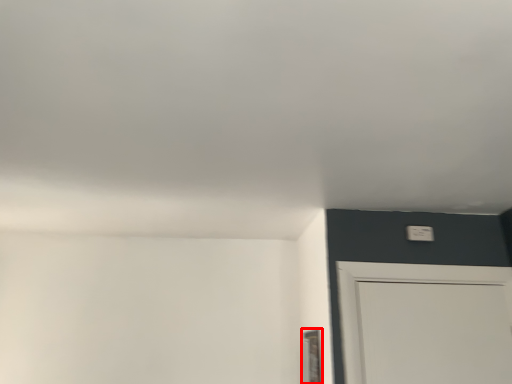
Question: In this image, where is window (annotated by the red box) located relative to light switch?

Choices:
 (A) left
 (B) right

Answer: (A)